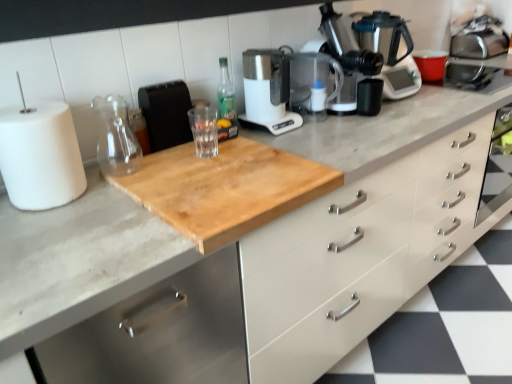
You are a GUI agent. You are given a task and a screenshot of the screen. Output one action in this format:
    pyautogui.click(x=<x>, y=<y>)
    Task: Click on the vacant area to the right of white matte paper towel at left
    The height and width of the screenshot is (384, 512).
    Given the screenshot: What is the action you would take?
    pyautogui.click(x=108, y=197)